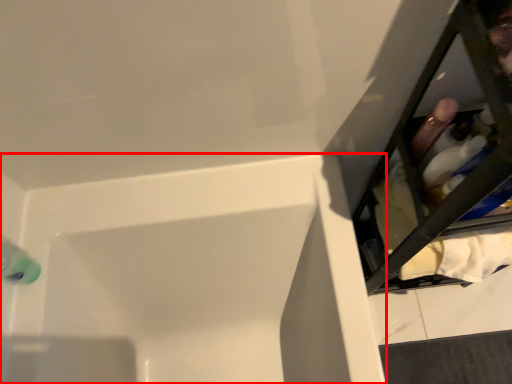
Question: From the image's perspective, considering the relative positions of bathtub (annotated by the red box) and furniture in the image provided, where is bathtub (annotated by the red box) located with respect to the staircase?

Choices:
 (A) above
 (B) below

Answer: (B)